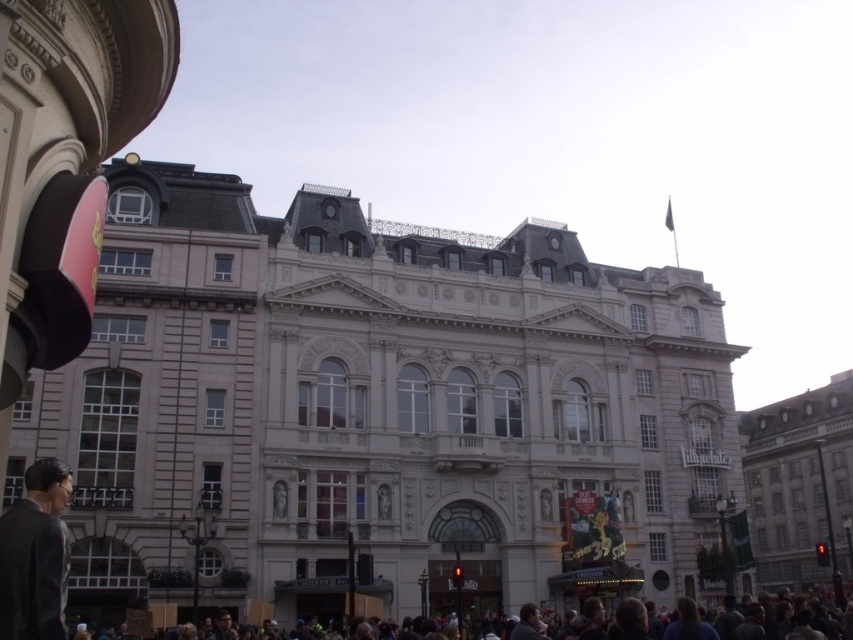
You are standing in front of the grand ornate building with classical architectural features in the urban area. You see dark gray clothing at lower center. Where exactly is the dark gray clothing located?

The dark gray clothing at lower center is located at point (701, 620).

Looking at this image, you are an event planner trying to decide where to place a new decorative banner. You see the dark gray clothing at lower center and the matte black glasses at lower center in the image. Which object is wider?

The dark gray clothing at lower center is wider than the matte black glasses at lower center.